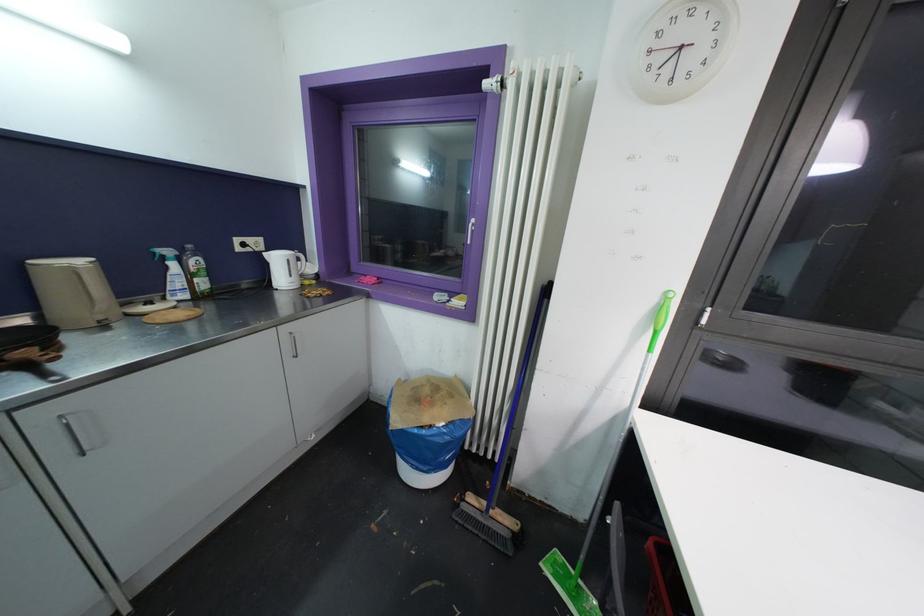
You are a GUI agent. You are given a task and a screenshot of the screen. Output one action in this format:
    pyautogui.click(x=<x>, y=<y>)
    Task: Click on the white trash bucket
    
    Given the screenshot: What is the action you would take?
    pos(428,427)